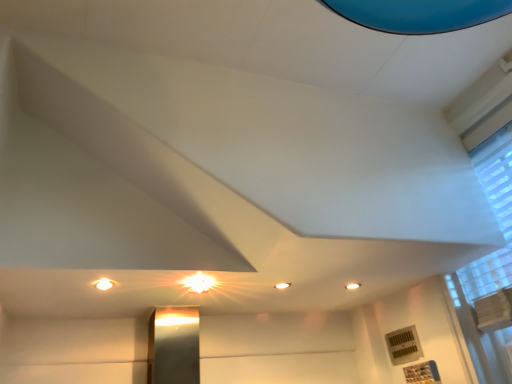
This screenshot has height=384, width=512. What do you see at coordinates (403, 345) in the screenshot? I see `metallic vent at lower right` at bounding box center [403, 345].

At what (x,y) coordinates should I click in order to perform the action: click on metallic vent at lower right. Please return your answer as a coordinate pair (x, y). Image resolution: width=512 pixels, height=384 pixels. Looking at the image, I should click on (403, 345).

The image size is (512, 384). What are the coordinates of `metallic vent at lower right` in the screenshot? It's located at (403, 345).